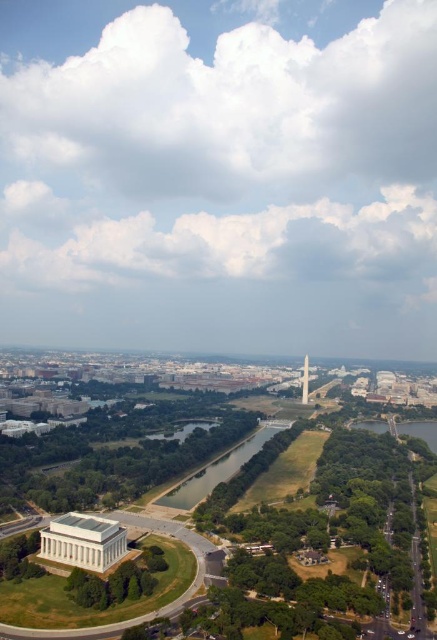
Question: Does green grassy field at center appear on the right side of white marble obelisk at center?

Choices:
 (A) no
 (B) yes

Answer: (A)

Question: Which object is closer to the camera taking this photo?

Choices:
 (A) white marble obelisk at center
 (B) green grassy field at center

Answer: (B)

Question: Does green grassy field at center come behind white marble obelisk at center?

Choices:
 (A) yes
 (B) no

Answer: (B)

Question: Among these points, which one is nearest to the camera?

Choices:
 (A) coord(280,426)
 (B) coord(305,369)

Answer: (A)

Question: Does green grassy field at center have a lesser width compared to white marble obelisk at center?

Choices:
 (A) no
 (B) yes

Answer: (A)

Question: Among these objects, which one is farthest from the camera?

Choices:
 (A) white marble obelisk at center
 (B) green grassy field at center

Answer: (A)